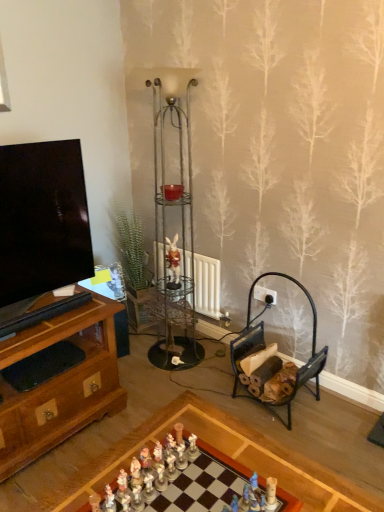
This screenshot has width=384, height=512. Describe the element at coordinates (177, 479) in the screenshot. I see `wooden chessboard at center` at that location.

The width and height of the screenshot is (384, 512). I want to click on shiny silver chess piece at center, arranged as the first toy when viewed from the left, so click(160, 478).

Measure the distance between point (239, 501) and camera.

Point (239, 501) is 1.21 meters from camera.

At what (x,y) coordinates should I click in order to perform the action: click on matte blue figurine at center, which is counted as the third toy, starting from the left. Please return your answer as a coordinate pair (x, y). This screenshot has height=512, width=384. Looking at the image, I should click on (244, 499).

You are a GUI agent. You are given a task and a screenshot of the screen. Output one action in this format:
    pyautogui.click(x=<x>, y=<y>)
    Task: Click on the matte brown figurine at center
    The width and height of the screenshot is (384, 512).
    Given the screenshot: What is the action you would take?
    pyautogui.click(x=173, y=263)

The image size is (384, 512). Describe the element at coordinates (207, 286) in the screenshot. I see `white painted radiator at center` at that location.

Locate an element on the screen. black metal firewood rack at lower right is located at coordinates (274, 361).

Can you confirm if white porcelain figurines at center, which ranks as the second toy in left-to-right order, is shorter than matte blue figurine at center, which appears as the first toy when viewed from the right?

Indeed, white porcelain figurines at center, which ranks as the second toy in left-to-right order, has a lesser height compared to matte blue figurine at center, which appears as the first toy when viewed from the right.

Between white porcelain figurines at center, positioned as the second toy in right-to-left order, and matte blue figurine at center, which is counted as the 3th toy, starting from the back, which one has larger size?

white porcelain figurines at center, positioned as the second toy in right-to-left order, is bigger.

From a real-world perspective, is white porcelain figurines at center, which ranks as the second toy in left-to-right order, on matte blue figurine at center, which is counted as the 3th toy, starting from the back?

No, from a real-world perspective, white porcelain figurines at center, which ranks as the second toy in left-to-right order, is not over matte blue figurine at center, which is counted as the 3th toy, starting from the back

Is white porcelain figurines at center, placed as the 1th toy when sorted from back to front, turned away from matte blue figurine at center, arranged as the first toy when viewed from the front?

white porcelain figurines at center, placed as the 1th toy when sorted from back to front, does not have its back to matte blue figurine at center, arranged as the first toy when viewed from the front.

From the image's perspective, is wooden chessboard at center positioned above or below matte glass candle holder at center?

From the image's perspective, wooden chessboard at center appears below matte glass candle holder at center.

Is wooden chessboard at center to the right of matte glass candle holder at center from the viewer's perspective?

Yes, wooden chessboard at center is to the right of matte glass candle holder at center.

This screenshot has height=512, width=384. In the image, there is a matte glass candle holder at center. Identify the location of table below it (from a real-world perspective). (177, 479).

Can you confirm if wooden chessboard at center is bigger than matte glass candle holder at center?

Yes.

Considering the relative sizes of shiny silver chess piece at center, positioned as the 2th toy in front-to-back order, and white porcelain figurines at center, which ranks as the second toy in left-to-right order, in the image provided, is shiny silver chess piece at center, positioned as the 2th toy in front-to-back order, wider than white porcelain figurines at center, which ranks as the second toy in left-to-right order,?

Correct, the width of shiny silver chess piece at center, positioned as the 2th toy in front-to-back order, exceeds that of white porcelain figurines at center, which ranks as the second toy in left-to-right order.

Considering the sizes of objects shiny silver chess piece at center, the 2th toy positioned from the back, and white porcelain figurines at center, placed as the 1th toy when sorted from back to front, in the image provided, who is bigger, shiny silver chess piece at center, the 2th toy positioned from the back, or white porcelain figurines at center, placed as the 1th toy when sorted from back to front,?

With larger size is shiny silver chess piece at center, the 2th toy positioned from the back.

Considering the positions of objects shiny silver chess piece at center, the 2th toy positioned from the back, and white porcelain figurines at center, positioned as the second toy in right-to-left order, in the image provided, who is more to the right, shiny silver chess piece at center, the 2th toy positioned from the back, or white porcelain figurines at center, positioned as the second toy in right-to-left order,?

From the viewer's perspective, white porcelain figurines at center, positioned as the second toy in right-to-left order, appears more on the right side.

Considering the relative sizes of matte blue figurine at center, which is counted as the third toy, starting from the left, and wooden chessboard at center in the image provided, is matte blue figurine at center, which is counted as the third toy, starting from the left, bigger than wooden chessboard at center?

No, matte blue figurine at center, which is counted as the third toy, starting from the left, is not bigger than wooden chessboard at center.

The height and width of the screenshot is (512, 384). Identify the location of table lying in front of the matte blue figurine at center, which is counted as the third toy, starting from the left. (177, 479).

Would you consider matte blue figurine at center, which is counted as the 3th toy, starting from the back, to be distant from wooden chessboard at center?

No, matte blue figurine at center, which is counted as the 3th toy, starting from the back, is not far away from wooden chessboard at center.

From the image's perspective, is white plastic power outlet at center-right located above or below white porcelain figurines at center, positioned as the second toy in right-to-left order?

white plastic power outlet at center-right is situated higher than white porcelain figurines at center, positioned as the second toy in right-to-left order, in the image.

Is white plastic power outlet at center-right next to white porcelain figurines at center, which ranks as the second toy in left-to-right order?

No, white plastic power outlet at center-right is not next to white porcelain figurines at center, which ranks as the second toy in left-to-right order.

Is white plastic power outlet at center-right positioned behind white porcelain figurines at center, placed as the 1th toy when sorted from back to front?

Yes, it is.

Based on their positions, is white plastic power outlet at center-right located to the left or right of white porcelain figurines at center, placed as the 1th toy when sorted from back to front?

In the image, white plastic power outlet at center-right appears on the right side of white porcelain figurines at center, placed as the 1th toy when sorted from back to front.

In the scene shown: Between matte blue figurine at center, arranged as the first toy when viewed from the front, and metallic wire shelving unit at center, which one has larger size?

Bigger between the two is metallic wire shelving unit at center.

Is the surface of matte blue figurine at center, which is counted as the third toy, starting from the left, in direct contact with metallic wire shelving unit at center?

No, matte blue figurine at center, which is counted as the third toy, starting from the left, is not in contact with metallic wire shelving unit at center.

What's the angular difference between matte blue figurine at center, which appears as the first toy when viewed from the right, and metallic wire shelving unit at center's facing directions?

They differ by 133 degrees in their facing directions.

From the image's perspective, between matte blue figurine at center, which appears as the first toy when viewed from the right, and metallic wire shelving unit at center, who is located below?

matte blue figurine at center, which appears as the first toy when viewed from the right, appears lower in the image.

From the picture: How far apart are white plastic power outlet at center-right and shiny silver chess piece at center, positioned as the 2th toy in front-to-back order?

white plastic power outlet at center-right is 1.40 meters from shiny silver chess piece at center, positioned as the 2th toy in front-to-back order.

Does white plastic power outlet at center-right turn towards shiny silver chess piece at center, arranged as the first toy when viewed from the left?

Yes, white plastic power outlet at center-right is facing shiny silver chess piece at center, arranged as the first toy when viewed from the left.

Is white plastic power outlet at center-right taller than shiny silver chess piece at center, marked as the 3th toy in a right-to-left arrangement?

Indeed, white plastic power outlet at center-right has a greater height compared to shiny silver chess piece at center, marked as the 3th toy in a right-to-left arrangement.

This screenshot has width=384, height=512. Find the location of `power outlet on the right side of shiny silver chess piece at center, marked as the 3th toy in a right-to-left arrangement`. power outlet on the right side of shiny silver chess piece at center, marked as the 3th toy in a right-to-left arrangement is located at coordinates (265, 295).

Where is `the 2nd toy behind the matte blue figurine at center, which appears as the first toy when viewed from the right, counting from the anchor's position`? The height and width of the screenshot is (512, 384). the 2nd toy behind the matte blue figurine at center, which appears as the first toy when viewed from the right, counting from the anchor's position is located at coordinates (181, 456).

Where is `shelf above the wooden chessboard at center (from the image's perspective)`? This screenshot has height=512, width=384. shelf above the wooden chessboard at center (from the image's perspective) is located at coordinates (173, 196).

Looking at this image, considering their positions, is wooden chessboard at center positioned further to white plastic power outlet at center-right than metallic wire shelving unit at center?

wooden chessboard at center lies further to white plastic power outlet at center-right than the other object.

From the picture: Based on their spatial positions, is matte blue figurine at center, which is counted as the third toy, starting from the left, or white painted radiator at center further from shiny silver chess piece at center, arranged as the first toy when viewed from the left?

Based on the image, white painted radiator at center appears to be further to shiny silver chess piece at center, arranged as the first toy when viewed from the left.

Based on their spatial positions, is white painted radiator at center or matte blue figurine at center, which appears as the first toy when viewed from the right, closer to wooden chessboard at center?

matte blue figurine at center, which appears as the first toy when viewed from the right, is closer to wooden chessboard at center.

Which object lies further to the anchor point matte glass candle holder at center, shiny silver chess piece at center, the 2th toy positioned from the back, or wooden chessboard at center?

shiny silver chess piece at center, the 2th toy positioned from the back, is further to matte glass candle holder at center.

When comparing their distances from white plastic power outlet at center-right, does matte glass candle holder at center or metallic wire shelving unit at center seem further?

Based on the image, matte glass candle holder at center appears to be further to white plastic power outlet at center-right.

Considering their positions, is white painted radiator at center positioned closer to shiny silver chess piece at center, arranged as the first toy when viewed from the left, than wooden chessboard at center?

wooden chessboard at center is positioned closer to the anchor shiny silver chess piece at center, arranged as the first toy when viewed from the left.

From the image, which object appears to be nearer to white porcelain figurines at center, which ranks as the second toy in left-to-right order, white painted radiator at center or metallic wire shelving unit at center?

The object closer to white porcelain figurines at center, which ranks as the second toy in left-to-right order, is white painted radiator at center.

When comparing their distances from white plastic power outlet at center-right, does black metal firewood rack at lower right or matte glass candle holder at center seem closer?

black metal firewood rack at lower right is closer to white plastic power outlet at center-right.

Image resolution: width=384 pixels, height=512 pixels. I want to click on toy located between shiny silver chess piece at center, marked as the 3th toy in a right-to-left arrangement, and matte blue figurine at center, arranged as the first toy when viewed from the front, in the left-right direction, so click(181, 456).

The image size is (384, 512). Find the location of `toy between shiny silver chess piece at center, the 2th toy positioned from the back, and matte glass candle holder at center from front to back`. toy between shiny silver chess piece at center, the 2th toy positioned from the back, and matte glass candle holder at center from front to back is located at coordinates (181, 456).

Where is `miniature between metallic wire shelving unit at center and white painted radiator at center from front to back`? miniature between metallic wire shelving unit at center and white painted radiator at center from front to back is located at coordinates (173, 263).

Where is `lamp positioned between matte blue figurine at center, which is counted as the third toy, starting from the left, and matte brown figurine at center from near to far`? The image size is (384, 512). lamp positioned between matte blue figurine at center, which is counted as the third toy, starting from the left, and matte brown figurine at center from near to far is located at coordinates pos(172,242).